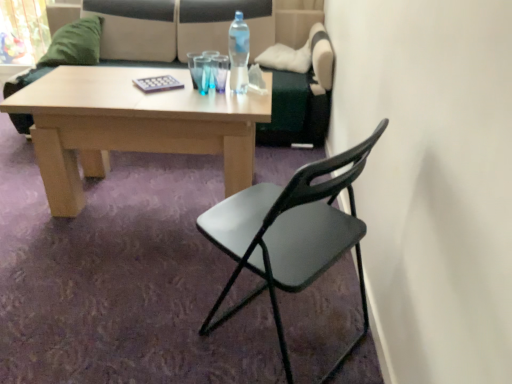
Image resolution: width=512 pixels, height=384 pixels. What are the coordinates of `free spot in front of beige fabric couch at upper center` in the screenshot? It's located at (139, 223).